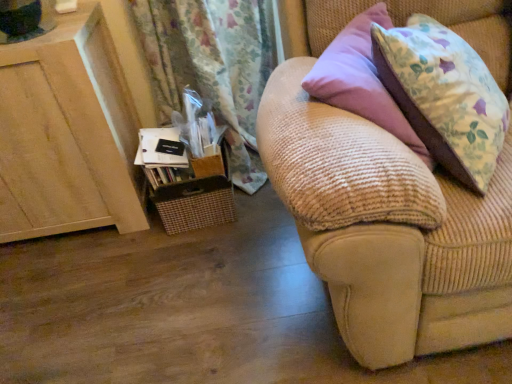
Question: Would you say beige corduroy couch at right is inside or outside wooden cabinet at left?

Choices:
 (A) outside
 (B) inside

Answer: (A)

Question: Looking at their shapes, would you say beige corduroy couch at right is wider or thinner than wooden cabinet at left?

Choices:
 (A) wide
 (B) thin

Answer: (A)

Question: Is beige corduroy couch at right in front of or behind wooden cabinet at left in the image?

Choices:
 (A) front
 (B) behind

Answer: (A)

Question: Considering the positions of wooden cabinet at left and beige corduroy couch at right in the image, is wooden cabinet at left wider or thinner than beige corduroy couch at right?

Choices:
 (A) wide
 (B) thin

Answer: (B)

Question: Relative to beige corduroy couch at right, is wooden cabinet at left in front or behind?

Choices:
 (A) behind
 (B) front

Answer: (A)

Question: Considering the positions of point (33, 231) and point (354, 289), is point (33, 231) closer or farther from the camera than point (354, 289)?

Choices:
 (A) closer
 (B) farther

Answer: (B)

Question: Is wooden cabinet at left inside the boundaries of beige corduroy couch at right, or outside?

Choices:
 (A) outside
 (B) inside

Answer: (A)